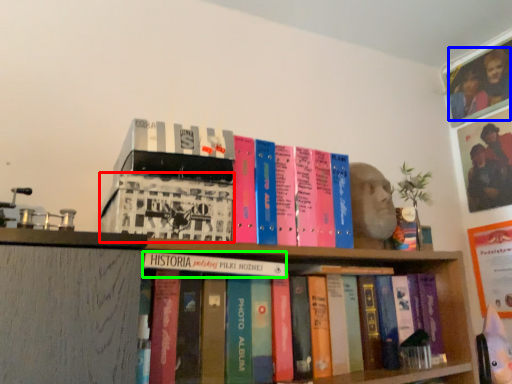
Question: Which object is positioned closest to book (highlighted by a red box)? Select from couple (highlighted by a blue box) and book (highlighted by a green box).

Choices:
 (A) couple
 (B) book

Answer: (B)